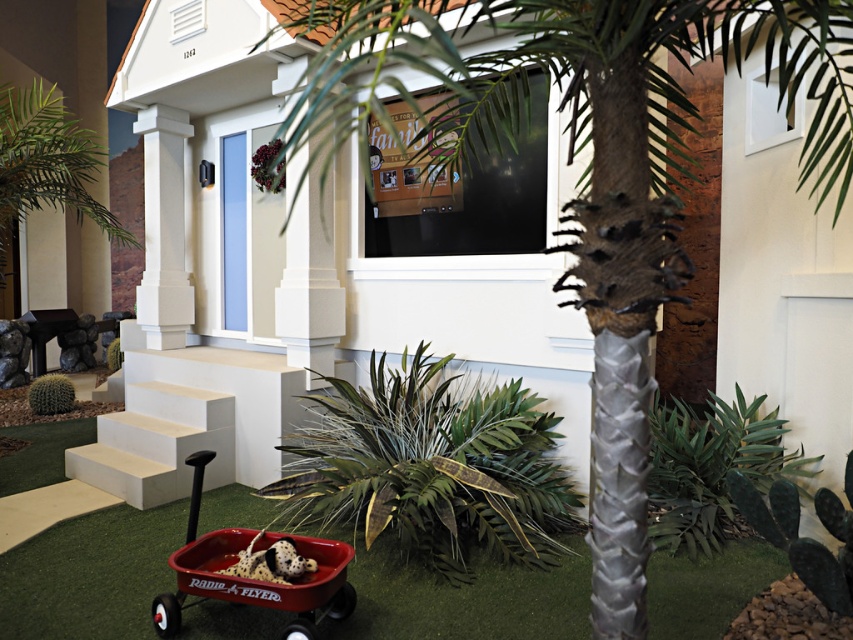
Question: Which point appears closest to the camera in this image?

Choices:
 (A) (262, 556)
 (B) (498, 604)

Answer: (A)

Question: Which point is farther to the camera?

Choices:
 (A) (618, 556)
 (B) (780, 554)

Answer: (B)

Question: Where is silver textured palm tree at center located in relation to red plastic wagon at lower left in the image?

Choices:
 (A) above
 (B) below

Answer: (A)

Question: Is green artificial turf at lower center smaller than white smooth stairs at lower left?

Choices:
 (A) yes
 (B) no

Answer: (A)

Question: Can you confirm if silver textured palm tree at center is positioned above green artificial turf at lower center?

Choices:
 (A) no
 (B) yes

Answer: (B)

Question: Which point appears closest to the camera in this image?

Choices:
 (A) [286, 17]
 (B) [734, 557]
 (C) [144, 502]
 (D) [299, 573]

Answer: (D)